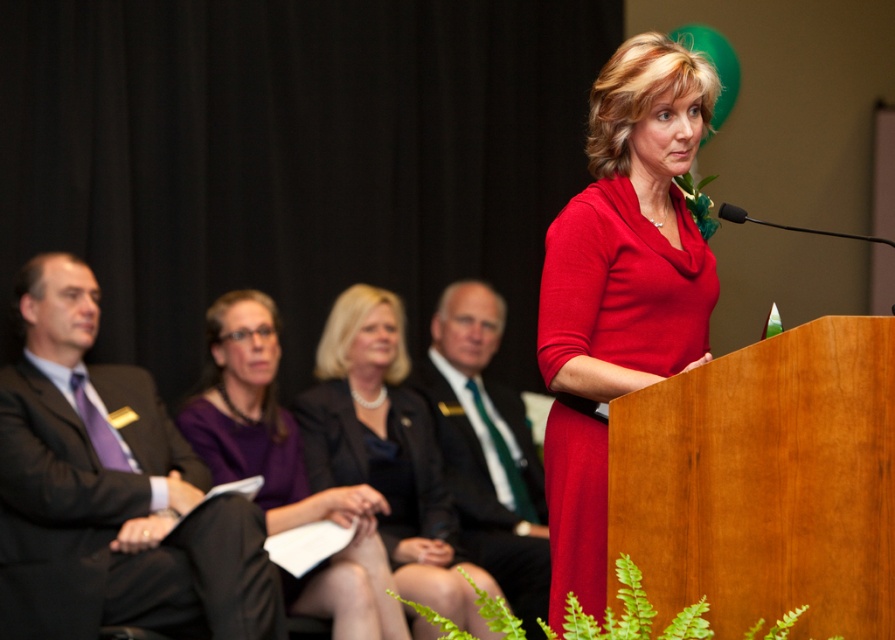
Question: Which point is closer to the camera?

Choices:
 (A) (570, 304)
 (B) (544, 605)

Answer: (A)

Question: In this image, where is matte black suit at center located relative to green silk tie at center?

Choices:
 (A) right
 (B) left

Answer: (B)

Question: Does matte black suit at left appear under green silk tie at center?

Choices:
 (A) yes
 (B) no

Answer: (A)

Question: Among these points, which one is nearest to the camera?

Choices:
 (A) (551, 342)
 (B) (291, 525)

Answer: (A)

Question: Is purple fabric dress at center above green silk tie at center?

Choices:
 (A) no
 (B) yes

Answer: (A)

Question: Which object is farther from the camera taking this photo?

Choices:
 (A) purple fabric dress at center
 (B) matte red dress at center

Answer: (A)